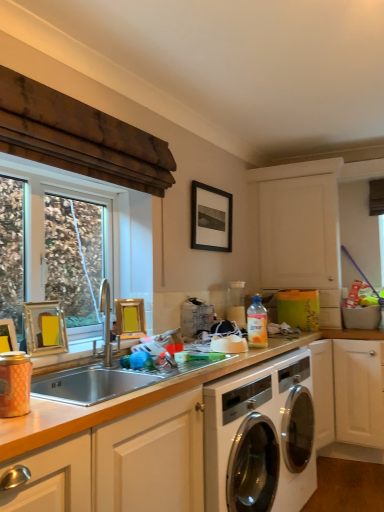
The width and height of the screenshot is (384, 512). What are the coordinates of `clear glass window at left` in the screenshot? It's located at (104, 228).

What do you see at coordinates (104, 228) in the screenshot? The width and height of the screenshot is (384, 512). I see `clear glass window at left` at bounding box center [104, 228].

Describe the element at coordinates (45, 328) in the screenshot. I see `gold metallic picture frame at left, the 2th picture frame in the top-to-bottom sequence` at that location.

Measure the distance between silver metallic sink at center and camera.

silver metallic sink at center and camera are 1.58 meters apart.

Where is `yellow matte picture frame at sink, which ranks as the 1th picture frame in bottom-to-top order`? The image size is (384, 512). yellow matte picture frame at sink, which ranks as the 1th picture frame in bottom-to-top order is located at coordinates (130, 318).

Based on the photo, in order to face black matte picture frame at upper center, placed as the 1th picture frame when sorted from top to bottom, should I rotate leftwards or rightwards?

You should look right and rotate roughly 3.038 degrees.

Identify the location of clear glass window at left. (104, 228).

From the image's perspective, is translucent plastic bottle at center located above or below black matte picture frame at upper center, placed as the 1th picture frame when sorted from top to bottom?

Clearly, from the image's perspective, translucent plastic bottle at center is below black matte picture frame at upper center, placed as the 1th picture frame when sorted from top to bottom.

Can you confirm if translucent plastic bottle at center is bigger than black matte picture frame at upper center, placed as the 1th picture frame when sorted from top to bottom?

No, translucent plastic bottle at center is not bigger than black matte picture frame at upper center, placed as the 1th picture frame when sorted from top to bottom.

Who is shorter, translucent plastic bottle at center or black matte picture frame at upper center, the 1th picture frame from the back?

translucent plastic bottle at center is shorter.

Considering the positions of objects translucent plastic bottle at center and black matte picture frame at upper center, placed as the 1th picture frame when sorted from top to bottom, in the image provided, who is more to the left, translucent plastic bottle at center or black matte picture frame at upper center, placed as the 1th picture frame when sorted from top to bottom,?

From the viewer's perspective, black matte picture frame at upper center, placed as the 1th picture frame when sorted from top to bottom, appears more on the left side.

Consider the image. Which of these two, clear glass window at left or gold metallic picture frame at left, acting as the first picture frame starting from the front, stands shorter?

gold metallic picture frame at left, acting as the first picture frame starting from the front, is shorter.

Considering the positions of point (33, 179) and point (5, 332), is point (33, 179) closer or farther from the camera than point (5, 332)?

Point (33, 179).

In the scene shown: Does clear glass window at left contain gold metallic picture frame at left, the 4th picture frame in the back-to-front sequence?

No, gold metallic picture frame at left, the 4th picture frame in the back-to-front sequence, is located outside of clear glass window at left.

In the scene shown: Considering the relative sizes of clear glass window at left and gold metallic picture frame at left, acting as the first picture frame starting from the front, in the image provided, is clear glass window at left smaller than gold metallic picture frame at left, acting as the first picture frame starting from the front,?

Actually, clear glass window at left might be larger than gold metallic picture frame at left, acting as the first picture frame starting from the front.

Between point (0, 331) and point (126, 326), which one is positioned behind?

Point (126, 326)

From the image's perspective, is gold metallic picture frame at left, acting as the first picture frame starting from the front, under yellow matte picture frame at sink, which is counted as the 4th picture frame, starting from the top?

Incorrect, from the image's perspective, gold metallic picture frame at left, acting as the first picture frame starting from the front, is higher than yellow matte picture frame at sink, which is counted as the 4th picture frame, starting from the top.

Considering the sizes of objects gold metallic picture frame at left, which ranks as the third picture frame in top-to-bottom order, and yellow matte picture frame at sink, which appears as the second picture frame when viewed from the right, in the image provided, who is taller, gold metallic picture frame at left, which ranks as the third picture frame in top-to-bottom order, or yellow matte picture frame at sink, which appears as the second picture frame when viewed from the right,?

yellow matte picture frame at sink, which appears as the second picture frame when viewed from the right, is taller.

Considering the relative sizes of gold metallic picture frame at left, placed as the 1th picture frame when sorted from left to right, and yellow matte picture frame at sink, which ranks as the 1th picture frame in bottom-to-top order, in the image provided, is gold metallic picture frame at left, placed as the 1th picture frame when sorted from left to right, wider than yellow matte picture frame at sink, which ranks as the 1th picture frame in bottom-to-top order,?

Yes, gold metallic picture frame at left, placed as the 1th picture frame when sorted from left to right, is wider than yellow matte picture frame at sink, which ranks as the 1th picture frame in bottom-to-top order.

Is point (194, 218) positioned before point (3, 337)?

No, (194, 218) is behind (3, 337).

Are black matte picture frame at upper center, placed as the 1th picture frame when sorted from top to bottom, and gold metallic picture frame at left, which ranks as the third picture frame in top-to-bottom order, far apart?

That's right, there is a large distance between black matte picture frame at upper center, placed as the 1th picture frame when sorted from top to bottom, and gold metallic picture frame at left, which ranks as the third picture frame in top-to-bottom order.

Is white glossy washing machine at center completely or partially inside gold metallic picture frame at left, placed as the 1th picture frame when sorted from left to right?

No, gold metallic picture frame at left, placed as the 1th picture frame when sorted from left to right, does not contain white glossy washing machine at center.

Where is `washing machine behind the gold metallic picture frame at left, the 4th picture frame in the back-to-front sequence`? washing machine behind the gold metallic picture frame at left, the 4th picture frame in the back-to-front sequence is located at coordinates (260, 437).

Between gold metallic picture frame at left, which ranks as the third picture frame in top-to-bottom order, and white glossy washing machine at center, which one appears on the left side from the viewer's perspective?

gold metallic picture frame at left, which ranks as the third picture frame in top-to-bottom order.

Looking at their sizes, would you say gold metallic picture frame at left, the 3th picture frame positioned from the right, is wider or thinner than black matte picture frame at upper center, which appears as the fourth picture frame when viewed from the front?

Clearly, gold metallic picture frame at left, the 3th picture frame positioned from the right, has more width compared to black matte picture frame at upper center, which appears as the fourth picture frame when viewed from the front.

Which point is more forward, [42,313] or [210,232]?

Point [42,313]

Is gold metallic picture frame at left, the 3th picture frame positioned from the right, smaller than black matte picture frame at upper center, placed as the fourth picture frame when sorted from left to right?

Yes.

Is gold metallic picture frame at left, placed as the third picture frame when sorted from back to front, looking in the opposite direction of black matte picture frame at upper center, the first picture frame in the right-to-left sequence?

No, gold metallic picture frame at left, placed as the third picture frame when sorted from back to front, is not facing away from black matte picture frame at upper center, the first picture frame in the right-to-left sequence.

Can you tell me how much white glossy washing machine at center and gold metallic picture frame at left, which appears as the 2th picture frame when viewed from the left, differ in facing direction?

They differ by 4.41 degrees in their facing directions.

Based on the photo, which object is wider, white glossy washing machine at center or gold metallic picture frame at left, which appears as the 2th picture frame when viewed from the left?

white glossy washing machine at center.

From the white glossy washing machine at center, count 1st picture frames forward and point to it. Please provide its 2D coordinates.

[(45, 328)]

Which is farther from the camera, (228, 499) or (47, 327)?

The point (47, 327) is more distant.

Where is `bottle that appears below the black matte picture frame at upper center, the 1th picture frame from the back (from a real-world perspective)`? bottle that appears below the black matte picture frame at upper center, the 1th picture frame from the back (from a real-world perspective) is located at coordinates (257, 324).

Locate an element on the screen. Image resolution: width=384 pixels, height=512 pixels. picture frame located on the left of clear glass window at left is located at coordinates (7, 336).

Based on their spatial positions, is white glossy washing machine at center or black matte picture frame at upper center, placed as the 1th picture frame when sorted from top to bottom, further from gold metallic picture frame at left, the 4th picture frame viewed from the right?

black matte picture frame at upper center, placed as the 1th picture frame when sorted from top to bottom, lies further to gold metallic picture frame at left, the 4th picture frame viewed from the right, than the other object.

Considering their positions, is matte pink canister at left positioned closer to silver metallic sink at center than black matte picture frame at upper center, the first picture frame in the right-to-left sequence?

matte pink canister at left lies closer to silver metallic sink at center than the other object.

Based on their spatial positions, is translucent plastic bottle at center or gold metallic picture frame at left, placed as the 1th picture frame when sorted from left to right, closer to yellow matte picture frame at sink, which is counted as the 4th picture frame, starting from the top?

Among the two, gold metallic picture frame at left, placed as the 1th picture frame when sorted from left to right, is located nearer to yellow matte picture frame at sink, which is counted as the 4th picture frame, starting from the top.

Looking at the image, which one is located closer to black matte picture frame at upper center, arranged as the fourth picture frame when ordered from the bottom, gold metallic picture frame at left, the 2th picture frame when ordered from front to back, or clear glass window at left?

clear glass window at left is closer to black matte picture frame at upper center, arranged as the fourth picture frame when ordered from the bottom.

Based on their spatial positions, is gold metallic picture frame at left, the third picture frame from the bottom, or silver metallic sink at center further from gold metallic picture frame at left, acting as the first picture frame starting from the front?

Among the two, silver metallic sink at center is located further to gold metallic picture frame at left, acting as the first picture frame starting from the front.

Estimate the real-world distances between objects in this image. Which object is closer to silver metallic sink at center, matte pink canister at left or gold metallic picture frame at left, placed as the third picture frame when sorted from back to front?

Based on the image, gold metallic picture frame at left, placed as the third picture frame when sorted from back to front, appears to be nearer to silver metallic sink at center.

Looking at this image, when comparing their distances from white glossy washing machine at center, does translucent plastic bottle at center or black matte picture frame at upper center, the 1th picture frame from the back, seem closer?

Based on the image, translucent plastic bottle at center appears to be nearer to white glossy washing machine at center.

Looking at the image, which one is located closer to gold metallic picture frame at left, the third picture frame from the bottom, black matte picture frame at upper center, the 1th picture frame from the back, or gold metallic picture frame at left, the 4th picture frame viewed from the right?

gold metallic picture frame at left, the 4th picture frame viewed from the right, is closer to gold metallic picture frame at left, the third picture frame from the bottom.

Find the location of a particular element. The image size is (384, 512). window between gold metallic picture frame at left, which appears as the 2th picture frame when viewed from the left, and black matte picture frame at upper center, the first picture frame in the right-to-left sequence, from front to back is located at coordinates (104, 228).

The height and width of the screenshot is (512, 384). In order to click on sink located between matte pink canister at left and white glossy washing machine at center in the depth direction in this screenshot , I will do `click(89, 384)`.

Where is `washing machine between clear glass window at left and translucent plastic bottle at center from left to right`? This screenshot has width=384, height=512. washing machine between clear glass window at left and translucent plastic bottle at center from left to right is located at coordinates (260, 437).

Find the location of a particular element. Image resolution: width=384 pixels, height=512 pixels. washing machine located between gold metallic picture frame at left, the 4th picture frame viewed from the right, and translucent plastic bottle at center in the left-right direction is located at coordinates (260, 437).